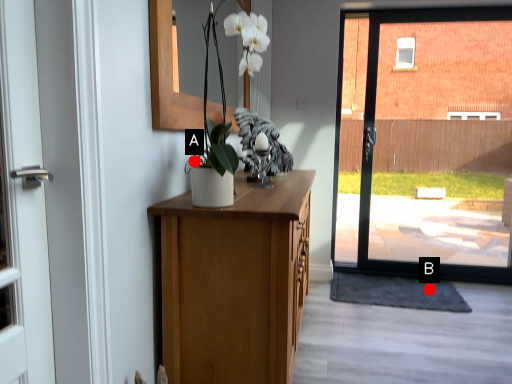
Question: Two points are circled on the image, labeled by A and B beside each circle. Which of the following is the farthest from the observer?

Choices:
 (A) A is further
 (B) B is further

Answer: (B)